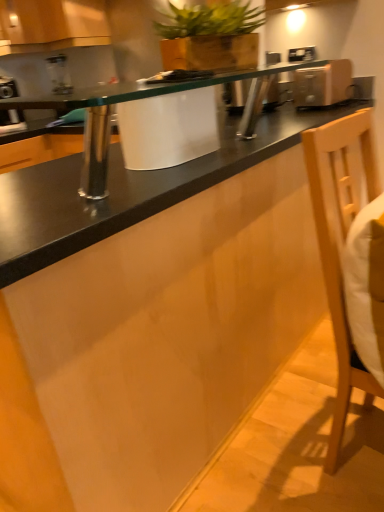
Question: Should I look upward or downward to see black glass countertop at center?

Choices:
 (A) down
 (B) up

Answer: (B)

Question: From the image's perspective, is wooden planter at upper center above metallic silver toaster at upper left, arranged as the 1th appliance when viewed from the left?

Choices:
 (A) yes
 (B) no

Answer: (B)

Question: Does wooden planter at upper center come behind metallic silver toaster at upper left, arranged as the 1th appliance when viewed from the left?

Choices:
 (A) no
 (B) yes

Answer: (A)

Question: Is the depth of wooden planter at upper center less than that of metallic silver toaster at upper left, arranged as the 1th appliance when viewed from the left?

Choices:
 (A) yes
 (B) no

Answer: (A)

Question: From a real-world perspective, is wooden planter at upper center on top of metallic silver toaster at upper left, the second appliance positioned from the front?

Choices:
 (A) yes
 (B) no

Answer: (A)

Question: Is wooden planter at upper center located outside metallic silver toaster at upper left, arranged as the 1th appliance when viewed from the left?

Choices:
 (A) no
 (B) yes

Answer: (B)

Question: Can you confirm if wooden planter at upper center is smaller than metallic silver toaster at upper left, the second appliance positioned from the front?

Choices:
 (A) no
 (B) yes

Answer: (B)

Question: Is metallic silver toaster at upper left, which ranks as the second appliance in right-to-left order, positioned beyond the bounds of light wood swivel chair at right?

Choices:
 (A) yes
 (B) no

Answer: (A)

Question: Is there a large distance between metallic silver toaster at upper left, which ranks as the second appliance in right-to-left order, and light wood swivel chair at right?

Choices:
 (A) no
 (B) yes

Answer: (B)

Question: From the image's perspective, does metallic silver toaster at upper left, arranged as the 1th appliance when viewed from the left, appear higher than light wood swivel chair at right?

Choices:
 (A) no
 (B) yes

Answer: (B)

Question: Can light wood swivel chair at right be found inside metallic silver toaster at upper left, arranged as the 1th appliance when viewed from the left?

Choices:
 (A) no
 (B) yes

Answer: (A)

Question: Could you tell me if metallic silver toaster at upper left, the second appliance positioned from the front, is facing light wood swivel chair at right?

Choices:
 (A) no
 (B) yes

Answer: (B)

Question: From a real-world perspective, is metallic silver toaster at upper left, the second appliance positioned from the front, below light wood swivel chair at right?

Choices:
 (A) no
 (B) yes

Answer: (A)

Question: Considering the relative positions of wooden planter at upper center and light wood swivel chair at right in the image provided, is wooden planter at upper center to the right of light wood swivel chair at right from the viewer's perspective?

Choices:
 (A) no
 (B) yes

Answer: (A)